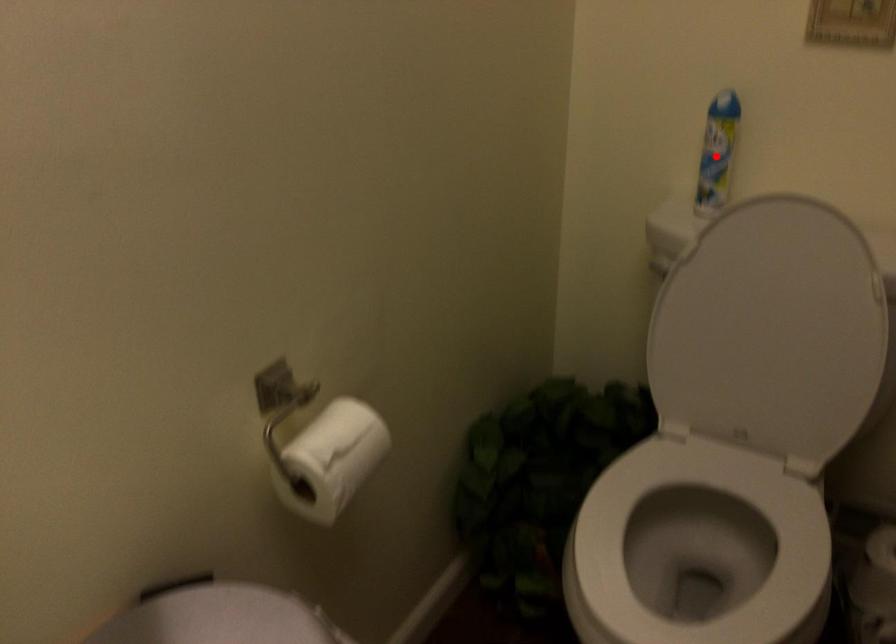
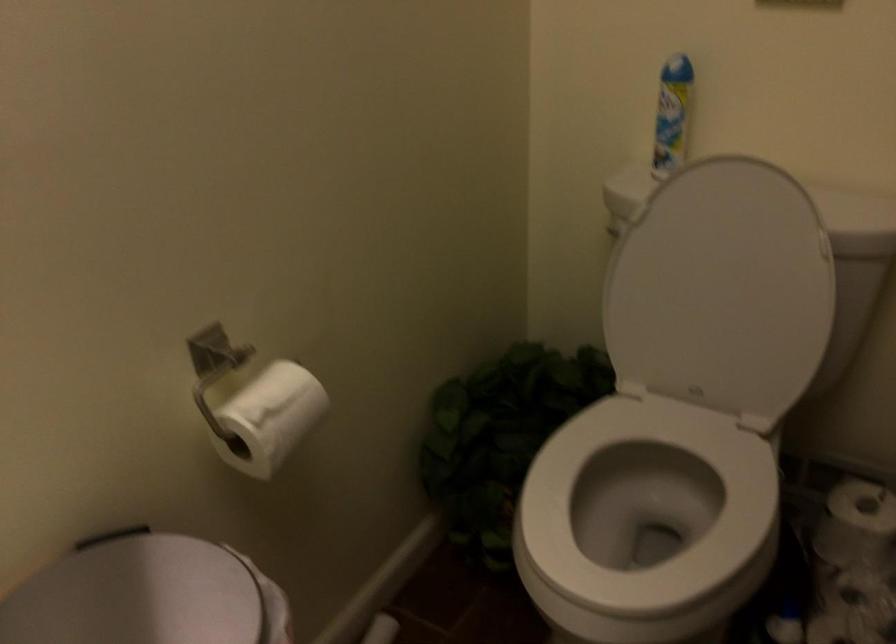
In the second image, find the point that corresponds to the highlighted location in the first image.

(672, 114)